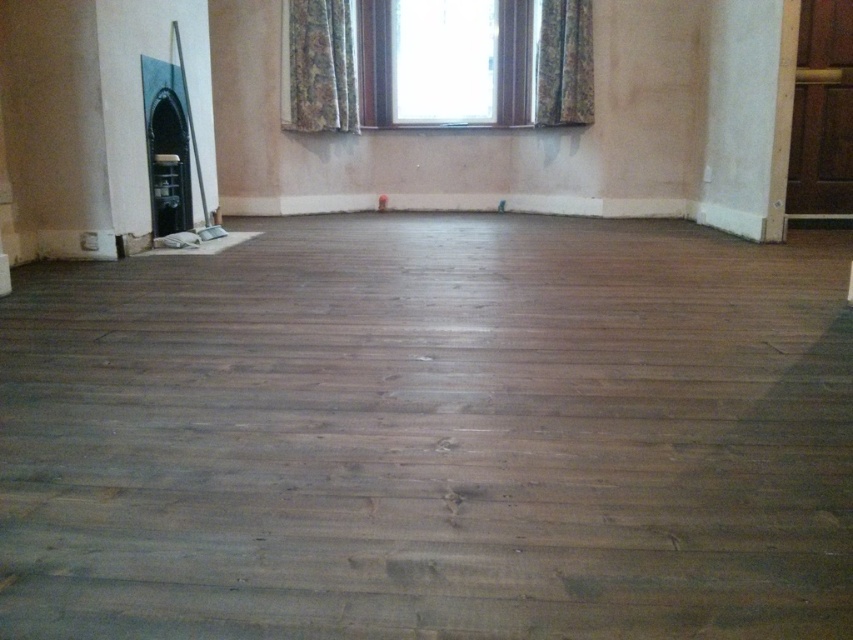
Who is taller, clear glass window at upper center or floral fabric curtain at upper center?

clear glass window at upper center

Is clear glass window at upper center bigger than floral fabric curtain at upper center?

Indeed, clear glass window at upper center has a larger size compared to floral fabric curtain at upper center.

What do you see at coordinates (444, 61) in the screenshot? I see `clear glass window at upper center` at bounding box center [444, 61].

Where is `clear glass window at upper center`? Image resolution: width=853 pixels, height=640 pixels. clear glass window at upper center is located at coordinates (444, 61).

Is dark brown wood floor at center above clear glass window at upper center?

No.

Which is below, dark brown wood floor at center or clear glass window at upper center?

dark brown wood floor at center is below.

Identify the location of dark brown wood floor at center. click(x=431, y=436).

Does dark brown wood floor at center appear on the right side of textured floral fabric at upper center?

In fact, dark brown wood floor at center is to the left of textured floral fabric at upper center.

Where is `dark brown wood floor at center`? This screenshot has width=853, height=640. dark brown wood floor at center is located at coordinates (431, 436).

Locate an element on the screen. dark brown wood floor at center is located at coordinates (431, 436).